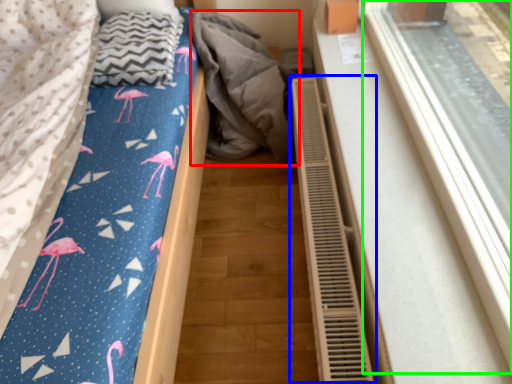
Question: Considering the real-world distances, which object is farthest from material (highlighted by a red box)? air conditioner (highlighted by a blue box) or window frame (highlighted by a green box)?

Choices:
 (A) air conditioner
 (B) window frame

Answer: (B)